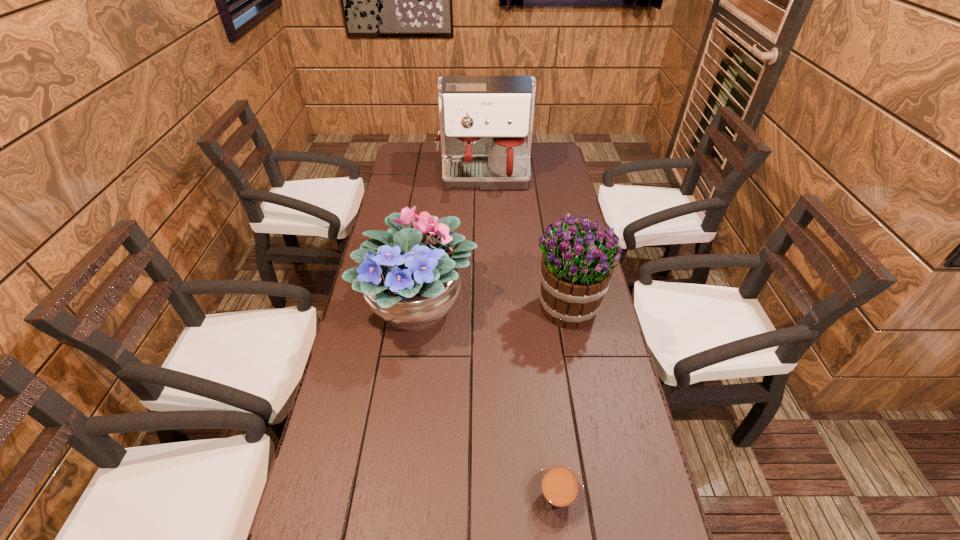
This screenshot has width=960, height=540. Identify the location of coffee maker. (486, 121).

This screenshot has width=960, height=540. I want to click on the right bouquet, so click(x=576, y=269).

Find the location of `the left bouquet`. the left bouquet is located at coordinates (410, 279).

Where is `cappuccino`? This screenshot has height=540, width=960. cappuccino is located at coordinates (556, 493).

The height and width of the screenshot is (540, 960). In order to click on the shortest object in this screenshot , I will do `click(556, 493)`.

Where is `free space located on the front of the farthest object near the spout`? The height and width of the screenshot is (540, 960). free space located on the front of the farthest object near the spout is located at coordinates (485, 208).

Find the location of a particular element. The height and width of the screenshot is (540, 960). free space located on the back of the right bouquet is located at coordinates (555, 244).

Locate an element on the screen. vacant space positioned on the right of the left bouquet is located at coordinates (537, 305).

I want to click on vacant space located on the back of the shortest object, so click(x=537, y=327).

Where is `object present at the far edge`? The width and height of the screenshot is (960, 540). object present at the far edge is located at coordinates (486, 121).